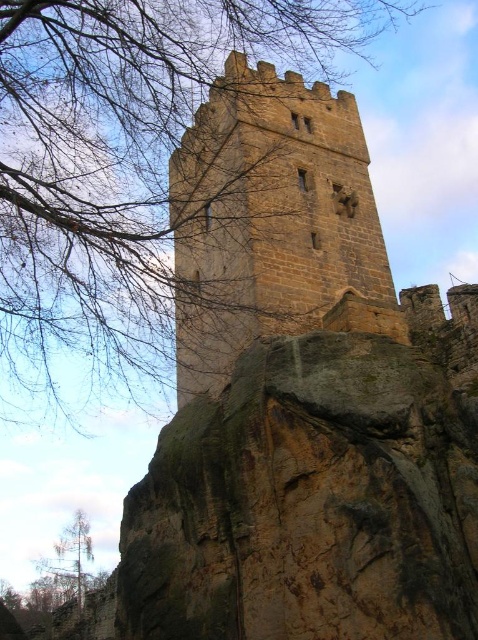
You are an architect examining the medieval stone tower. You notice an object in the image. Where is the bare branches at upper left located in the image coordinates?

The bare branches at upper left are located at point coordinates of (120, 163).

You are an architect examining a medieval stone tower. You notice a specific point marked at coordinates point (120, 163). What object is located at that point?

The point (120, 163) is occupied by bare branches at upper left.

You are an archer positioned at the base of the brown stone tower at center. You notice the bare branches at upper left above you. Could you shoot an arrow through one of the tower windows without the branches obstructing your shot?

The bare branches at upper left are positioned over the brown stone tower at center, so they might obstruct your line of sight or trajectory. Adjust your aim to avoid the branches or choose a window not directly beneath them.